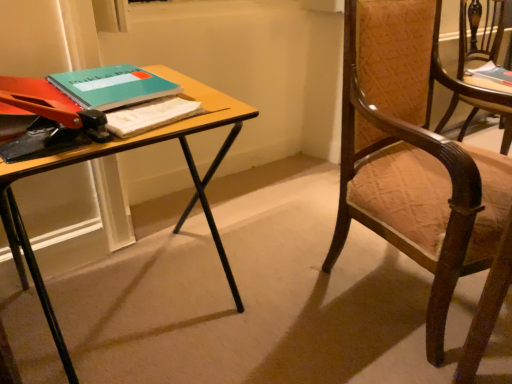
What do you see at coordinates (488, 76) in the screenshot?
I see `teal matte book at upper right, the 1th book positioned from the back` at bounding box center [488, 76].

The width and height of the screenshot is (512, 384). I want to click on wooden desk at center, so click(114, 155).

Who is shorter, teal matte book at upper right, which is the first book in right-to-left order, or teal matte notebook at upper left, which is the second book in top-to-bottom order?

teal matte notebook at upper left, which is the second book in top-to-bottom order.

From a real-world perspective, who is located higher, teal matte book at upper right, placed as the 2th book when sorted from bottom to top, or teal matte notebook at upper left, which ranks as the first book in left-to-right order?

In real-world perspective, teal matte notebook at upper left, which ranks as the first book in left-to-right order, is above.

Is teal matte book at upper right, the 1th book positioned from the back, placed right next to teal matte notebook at upper left, arranged as the second book when viewed from the right?

teal matte book at upper right, the 1th book positioned from the back, and teal matte notebook at upper left, arranged as the second book when viewed from the right, are clearly separated.

From the image's perspective, would you say teal matte book at upper right, the 1th book positioned from the back, is positioned over teal matte notebook at upper left, arranged as the first book when viewed from the front?

Correct, teal matte book at upper right, the 1th book positioned from the back, appears higher than teal matte notebook at upper left, arranged as the first book when viewed from the front, in the image.

From their relative heights in the image, would you say teal matte notebook at upper left, arranged as the first book when viewed from the front, is taller or shorter than wooden textured chair at right, the second chair from the front?

Clearly, teal matte notebook at upper left, arranged as the first book when viewed from the front, is shorter compared to wooden textured chair at right, the second chair from the front.

How far apart are teal matte notebook at upper left, which is the second book in top-to-bottom order, and wooden textured chair at right, which is counted as the 1th chair, starting from the back?

teal matte notebook at upper left, which is the second book in top-to-bottom order, is 5.17 feet away from wooden textured chair at right, which is counted as the 1th chair, starting from the back.

Is teal matte notebook at upper left, which is the second book in top-to-bottom order, far away from wooden textured chair at right, the second chair when ordered from left to right?

Yes, teal matte notebook at upper left, which is the second book in top-to-bottom order, and wooden textured chair at right, the second chair when ordered from left to right, are located far from each other.

Is teal matte notebook at upper left, which is the second book in top-to-bottom order, wider or thinner than wooden textured chair at right, the second chair from the front?

Clearly, teal matte notebook at upper left, which is the second book in top-to-bottom order, has less width compared to wooden textured chair at right, the second chair from the front.

From the wooden chair with upholstered seat at right, which is counted as the 1th chair, starting from the front, count 2nd books backward and point to it. Please provide its 2D coordinates.

[(488, 76)]

Does wooden chair with upholstered seat at right, which appears as the 2th chair when viewed from the back, lie behind teal matte book at upper right, positioned as the first book in top-to-bottom order?

No, it is in front of teal matte book at upper right, positioned as the first book in top-to-bottom order.

Based on their sizes in the image, would you say wooden chair with upholstered seat at right, which appears as the 2th chair when viewed from the back, is bigger or smaller than teal matte book at upper right, which appears as the 2th book when viewed from the left?

Clearly, wooden chair with upholstered seat at right, which appears as the 2th chair when viewed from the back, is larger in size than teal matte book at upper right, which appears as the 2th book when viewed from the left.

Is wooden textured chair at right, which is counted as the 1th chair, starting from the back, thinner than wooden desk at center?

Yes.

Would you say wooden textured chair at right, the second chair from the front, contains wooden desk at center?

No.

Locate an element on the screen. This screenshot has height=384, width=512. desk that is in front of the wooden textured chair at right, the second chair from the front is located at coordinates (114, 155).

Is wooden textured chair at right, the second chair when ordered from left to right, in front of or behind wooden desk at center in the image?

wooden textured chair at right, the second chair when ordered from left to right, is positioned farther from the viewer than wooden desk at center.

In the scene shown: Is teal matte book at upper right, which appears as the 2th book when viewed from the left, at the back of wooden desk at center?

No, wooden desk at center is not facing away from teal matte book at upper right, which appears as the 2th book when viewed from the left.

From a real-world perspective, relative to teal matte book at upper right, the second book from the front, is wooden desk at center vertically above or below?

Clearly, from a real-world perspective, wooden desk at center is below teal matte book at upper right, the second book from the front.

I want to click on desk below the teal matte book at upper right, placed as the 2th book when sorted from bottom to top (from a real-world perspective), so click(114, 155).

Is wooden desk at center next to teal matte book at upper right, positioned as the first book in top-to-bottom order, and touching it?

No, wooden desk at center is not touching teal matte book at upper right, positioned as the first book in top-to-bottom order.

Who is bigger, wooden desk at center or wooden textured chair at right, acting as the 1th chair starting from the right?

Bigger between the two is wooden desk at center.

From the image's perspective, between wooden desk at center and wooden textured chair at right, the second chair from the front, which one is located above?

From the image's view, wooden textured chair at right, the second chair from the front, is above.

Is wooden desk at center outside of wooden textured chair at right, acting as the 1th chair starting from the right?

Yes.

Between point (61, 164) and point (509, 111), which one is positioned in front?

The point (61, 164) is closer.

Is wooden chair with upholstered seat at right, which appears as the 2th chair when viewed from the back, far away from wooden textured chair at right, the second chair when ordered from left to right?

No, wooden chair with upholstered seat at right, which appears as the 2th chair when viewed from the back, is in close proximity to wooden textured chair at right, the second chair when ordered from left to right.

Find the location of a particular element. Image resolution: width=512 pixels, height=384 pixels. chair on the right of the wooden chair with upholstered seat at right, positioned as the second chair in right-to-left order is located at coordinates (482, 33).

Which is further, (379, 111) or (478, 104)?

The point (478, 104) is behind.

Measure the distance from wooden chair with upholstered seat at right, which is counted as the 1th chair, starting from the front, to wooden textured chair at right, acting as the 1th chair starting from the right.

The distance of wooden chair with upholstered seat at right, which is counted as the 1th chair, starting from the front, from wooden textured chair at right, acting as the 1th chair starting from the right, is 32.86 inches.

Locate an element on the screen. The image size is (512, 384). book on the right of teal matte notebook at upper left, the 2th book viewed from the back is located at coordinates (488, 76).

The width and height of the screenshot is (512, 384). In order to click on book that appears below the wooden textured chair at right, the second chair when ordered from left to right (from the image's perspective) in this screenshot , I will do `click(112, 86)`.

In the scene shown: From the image, which object appears to be farther from wooden desk at center, wooden textured chair at right, acting as the 1th chair starting from the right, or teal matte book at upper right, the second book from the front?

Among the two, teal matte book at upper right, the second book from the front, is located further to wooden desk at center.

Estimate the real-world distances between objects in this image. Which object is closer to wooden textured chair at right, which is counted as the 1th chair, starting from the back, wooden chair with upholstered seat at right, which appears as the 2th chair when viewed from the back, or teal matte book at upper right, which is the first book in right-to-left order?

teal matte book at upper right, which is the first book in right-to-left order, is positioned closer to the anchor wooden textured chair at right, which is counted as the 1th chair, starting from the back.

Based on their spatial positions, is wooden chair with upholstered seat at right, positioned as the second chair in right-to-left order, or teal matte notebook at upper left, which is the first book from bottom to top, further from teal matte book at upper right, which is the first book in right-to-left order?

Among the two, teal matte notebook at upper left, which is the first book from bottom to top, is located further to teal matte book at upper right, which is the first book in right-to-left order.

Looking at the image, which one is located further to wooden desk at center, wooden textured chair at right, the second chair when ordered from left to right, or wooden chair with upholstered seat at right, positioned as the second chair in right-to-left order?

wooden textured chair at right, the second chair when ordered from left to right.

Based on their spatial positions, is wooden chair with upholstered seat at right, positioned as the second chair in right-to-left order, or teal matte book at upper right, which is the first book in right-to-left order, further from teal matte notebook at upper left, arranged as the first book when viewed from the front?

Among the two, teal matte book at upper right, which is the first book in right-to-left order, is located further to teal matte notebook at upper left, arranged as the first book when viewed from the front.

When comparing their distances from wooden desk at center, does wooden chair with upholstered seat at right, acting as the first chair starting from the left, or teal matte notebook at upper left, which is the second book in top-to-bottom order, seem further?

wooden chair with upholstered seat at right, acting as the first chair starting from the left, is positioned further to the anchor wooden desk at center.

Considering their positions, is wooden chair with upholstered seat at right, positioned as the second chair in right-to-left order, positioned closer to wooden desk at center than teal matte book at upper right, positioned as the first book in top-to-bottom order?

wooden chair with upholstered seat at right, positioned as the second chair in right-to-left order, lies closer to wooden desk at center than the other object.

Estimate the real-world distances between objects in this image. Which object is further from teal matte notebook at upper left, the 2th book viewed from the back, teal matte book at upper right, placed as the 2th book when sorted from bottom to top, or wooden chair with upholstered seat at right, which is counted as the 1th chair, starting from the front?

Among the two, teal matte book at upper right, placed as the 2th book when sorted from bottom to top, is located further to teal matte notebook at upper left, the 2th book viewed from the back.

You are a GUI agent. You are given a task and a screenshot of the screen. Output one action in this format:
    pyautogui.click(x=<x>, y=<y>)
    Task: Click on the book located between wooden desk at center and teal matte book at upper right, the 1th book positioned from the back, in the left-right direction
    
    Given the screenshot: What is the action you would take?
    pyautogui.click(x=112, y=86)

At what (x,y) coordinates should I click in order to perform the action: click on book located between wooden desk at center and wooden chair with upholstered seat at right, which is counted as the 1th chair, starting from the front, in the left-right direction. Please return your answer as a coordinate pair (x, y). The height and width of the screenshot is (384, 512). Looking at the image, I should click on (112, 86).

Locate an element on the screen. book between wooden desk at center and wooden textured chair at right, which is counted as the 1th chair, starting from the back, in the horizontal direction is located at coordinates (112, 86).

Find the location of a particular element. chair between wooden chair with upholstered seat at right, which appears as the 2th chair when viewed from the back, and teal matte book at upper right, the second book from the front, in the front-back direction is located at coordinates (482, 33).